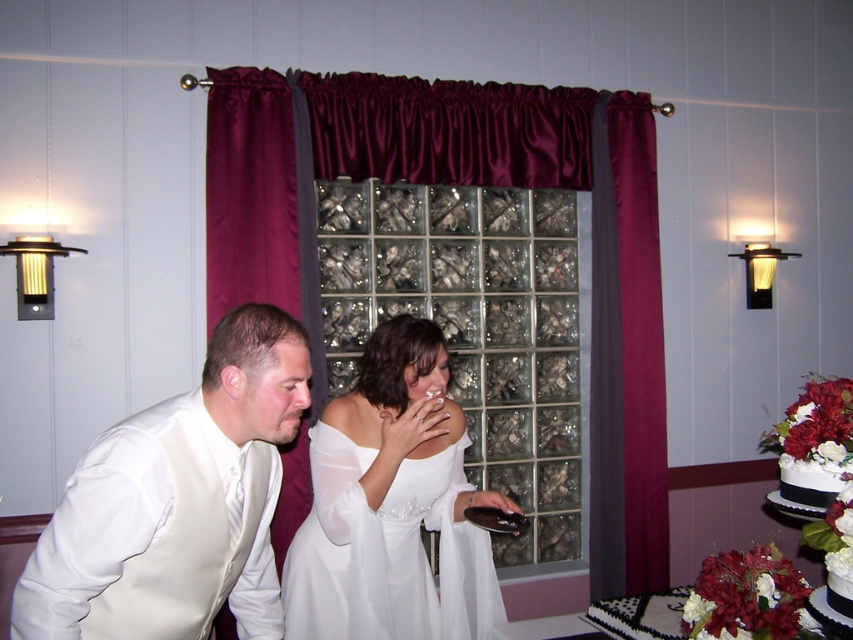
Between white satin vest at left and white satin dress at center, which one is positioned lower?

white satin dress at center is below.

Between white satin vest at left and white satin dress at center, which one has more height?

white satin dress at center is taller.

Is point (259, 484) less distant than point (357, 422)?

Yes, it is.

In order to click on white satin vest at left in this screenshot , I will do `click(177, 502)`.

Between maroon satin curtain at center and white satin vest at left, which one appears on the right side from the viewer's perspective?

From the viewer's perspective, maroon satin curtain at center appears more on the right side.

Is maroon satin curtain at center thinner than white satin vest at left?

Incorrect, maroon satin curtain at center's width is not less than white satin vest at left's.

Describe the element at coordinates (590, 250) in the screenshot. I see `maroon satin curtain at center` at that location.

This screenshot has height=640, width=853. Identify the location of maroon satin curtain at center. (x=590, y=250).

Between maroon satin curtain at center and white satin dress at center, which one is positioned lower?

white satin dress at center is below.

Where is `maroon satin curtain at center`? maroon satin curtain at center is located at coordinates (590, 250).

The width and height of the screenshot is (853, 640). What do you see at coordinates (590, 250) in the screenshot?
I see `maroon satin curtain at center` at bounding box center [590, 250].

You are a GUI agent. You are given a task and a screenshot of the screen. Output one action in this format:
    pyautogui.click(x=<x>, y=<y>)
    Task: Click on the maroon satin curtain at center
    The height and width of the screenshot is (640, 853).
    Given the screenshot: What is the action you would take?
    pyautogui.click(x=590, y=250)